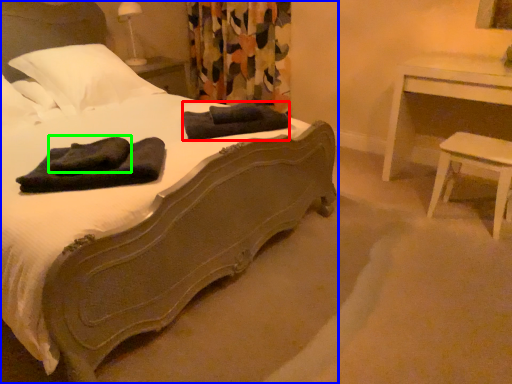
Question: Estimate the real-world distances between objects in this image. Which object is closer to bath towel (highlighted by a red box), bed (highlighted by a blue box) or bath towel (highlighted by a green box)?

Choices:
 (A) bed
 (B) bath towel

Answer: (A)